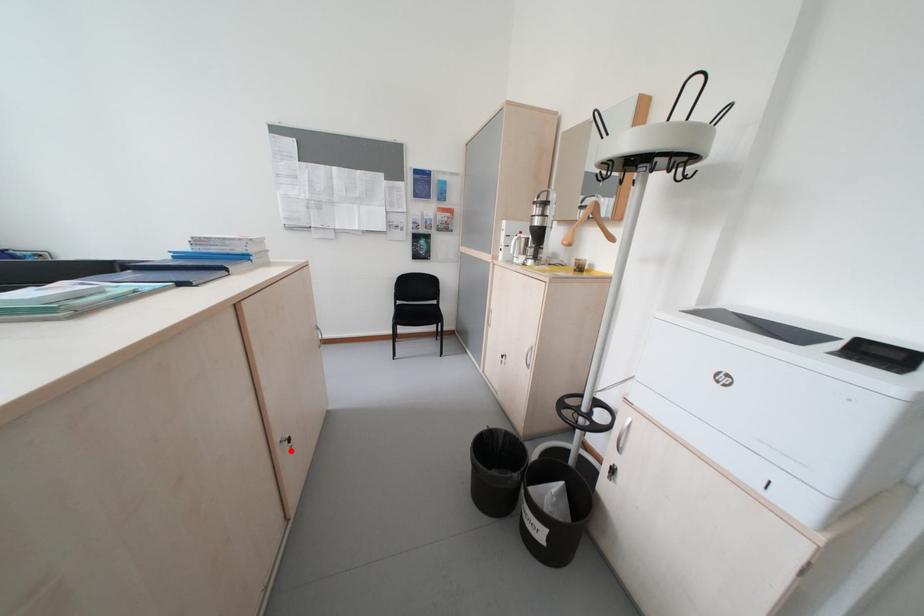
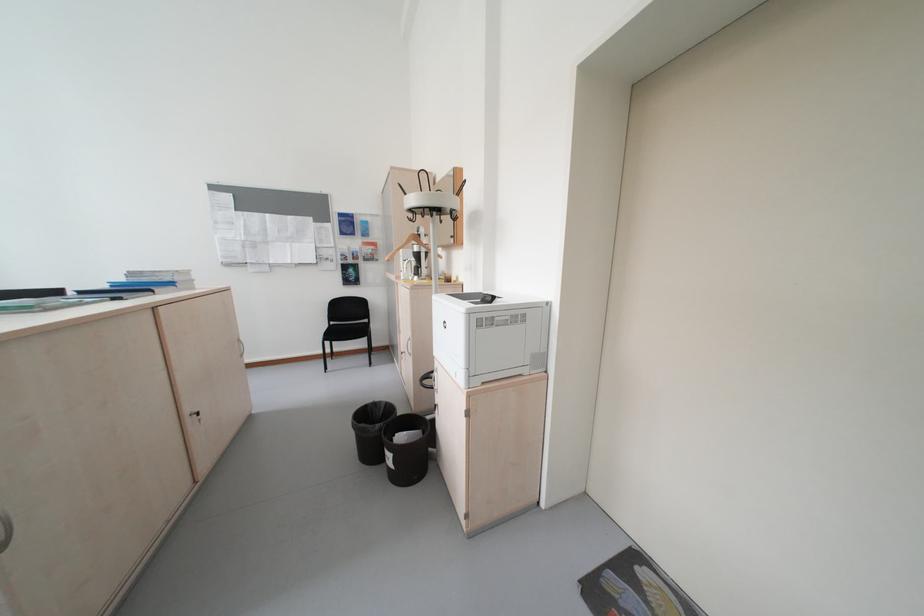
Question: I am providing you with two images of the same scene from different viewpoints. Image1 has a red point marked. In image2, the corresponding 3D location appears at what relative position? Reply with the corresponding letter.

Choices:
 (A) Closer
 (B) Farther

Answer: (B)